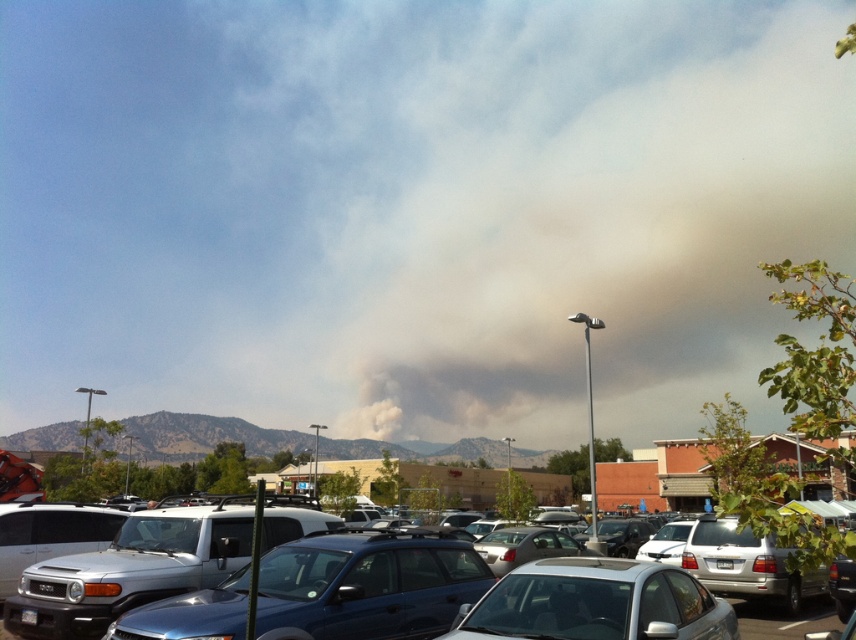
Is point (438, 561) farther from camera compared to point (801, 614)?

No, (438, 561) is in front of (801, 614).

Can you confirm if metallic blue suv at center is positioned below metallic silver car at center?

No.

Which is in front, point (242, 579) or point (795, 632)?

Point (242, 579)

The height and width of the screenshot is (640, 856). I want to click on metallic blue suv at center, so click(x=367, y=584).

Who is positioned more to the left, metallic blue suv at center or smokey gray sedan at center?

From the viewer's perspective, metallic blue suv at center appears more on the left side.

Which of these two, metallic blue suv at center or smokey gray sedan at center, stands shorter?

metallic blue suv at center is shorter.

This screenshot has width=856, height=640. What do you see at coordinates (367, 584) in the screenshot?
I see `metallic blue suv at center` at bounding box center [367, 584].

Locate an element on the screen. metallic blue suv at center is located at coordinates (367, 584).

Between smokey gray sedan at center and metallic silver car at center, which one is positioned higher?

smokey gray sedan at center

How far apart are smokey gray sedan at center and metallic silver car at center?

smokey gray sedan at center and metallic silver car at center are 5.80 meters apart from each other.

Who is more forward, (654, 573) or (798, 621)?

Point (654, 573) is in front.

Image resolution: width=856 pixels, height=640 pixels. I want to click on smokey gray sedan at center, so click(597, 604).